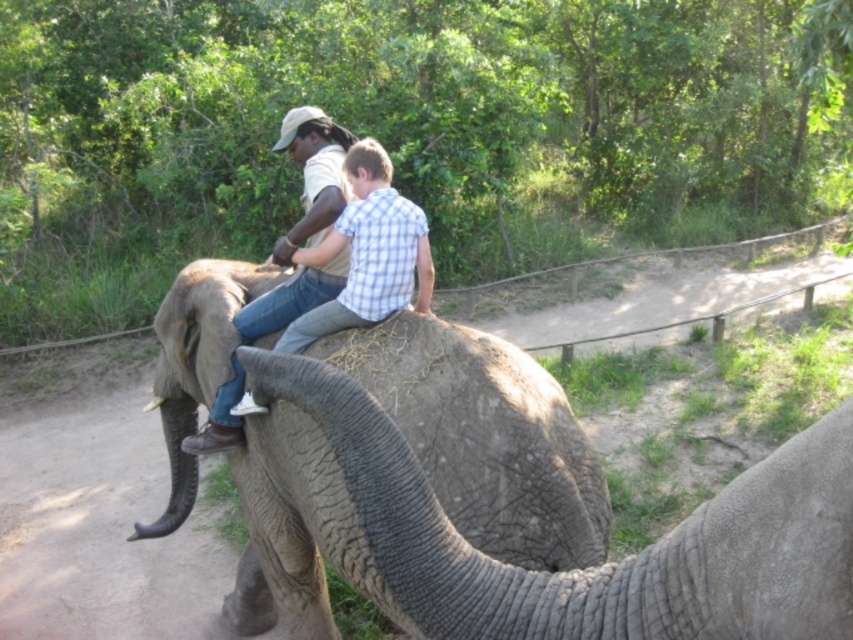
Question: Can you confirm if gray textured elephant at center is bigger than matte khaki shirt at center?

Choices:
 (A) yes
 (B) no

Answer: (A)

Question: Can you confirm if gray textured elephant at center is positioned below matte khaki shirt at center?

Choices:
 (A) yes
 (B) no

Answer: (A)

Question: Is gray textured elephant at center to the left of matte khaki shirt at center from the viewer's perspective?

Choices:
 (A) yes
 (B) no

Answer: (B)

Question: Which of the following is the farthest from the observer?

Choices:
 (A) (247, 452)
 (B) (265, 307)

Answer: (B)